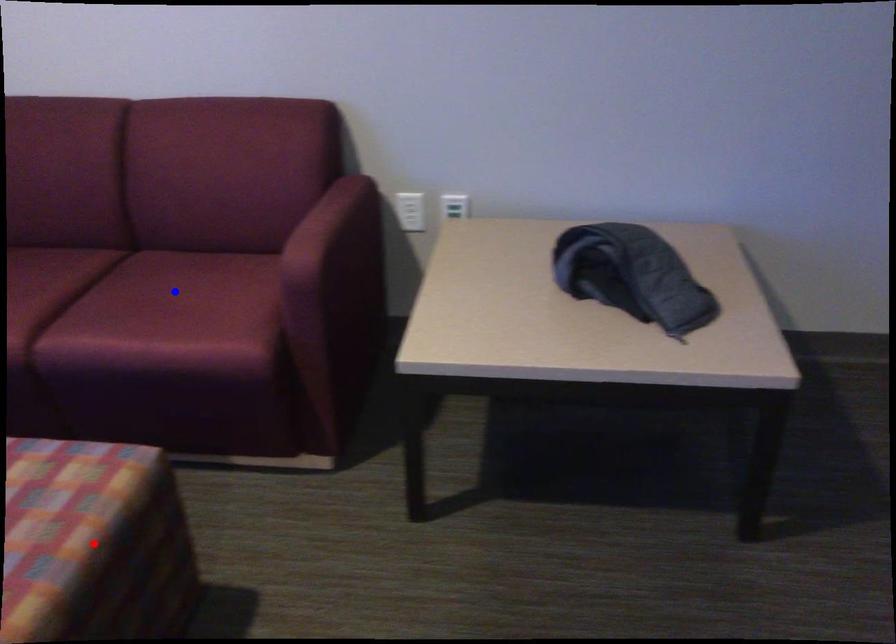
Question: Two points are marked on the image. Which point is closer to the camera?

Choices:
 (A) Blue point is closer.
 (B) Red point is closer.

Answer: (B)